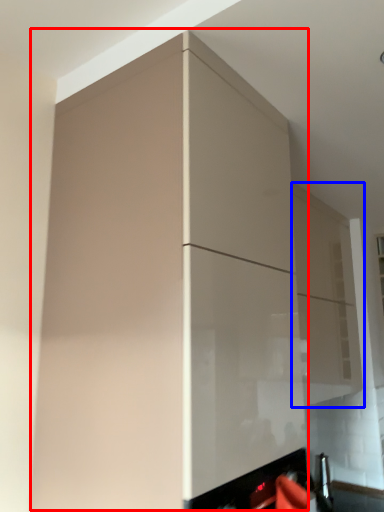
Question: Among these objects, which one is nearest to the camera, cabinetry (highlighted by a red box) or cabinetry (highlighted by a blue box)?

Choices:
 (A) cabinetry
 (B) cabinetry

Answer: (A)